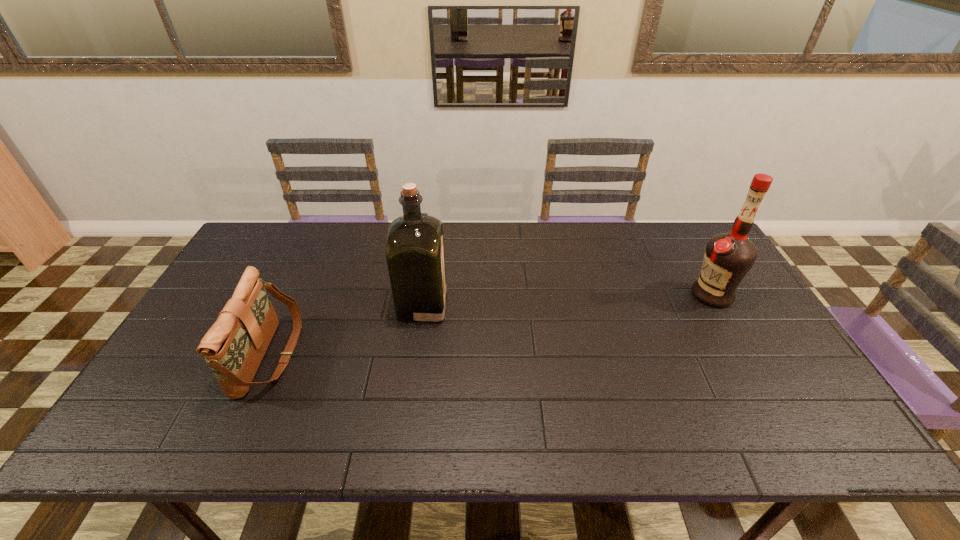
This screenshot has height=540, width=960. Find the location of `blank space at the far edge of the desktop`. blank space at the far edge of the desktop is located at coordinates (368, 237).

What are the coordinates of `vacant space at the near edge of the desktop` in the screenshot? It's located at (658, 430).

The width and height of the screenshot is (960, 540). In the image, there is a desktop. What are the coordinates of `free space at the right edge` in the screenshot? It's located at (741, 315).

Where is `free location at the far left corner of the desktop`? This screenshot has width=960, height=540. free location at the far left corner of the desktop is located at coordinates (270, 235).

In the image, there is a desktop. Identify the location of vacant space at the far right corner. (677, 261).

Where is `free space at the near right corner`? This screenshot has height=540, width=960. free space at the near right corner is located at coordinates (787, 429).

Locate an element on the screen. unoccupied area between the second object from left to right and the shoulder bag is located at coordinates (347, 330).

The width and height of the screenshot is (960, 540). In order to click on free space between the shortest object and the second object from right to left in this screenshot , I will do `click(347, 330)`.

I want to click on free area in between the left liquor and the rightmost object, so click(x=567, y=299).

Image resolution: width=960 pixels, height=540 pixels. I want to click on vacant space that is in between the right liquor and the second object from left to right, so click(x=567, y=299).